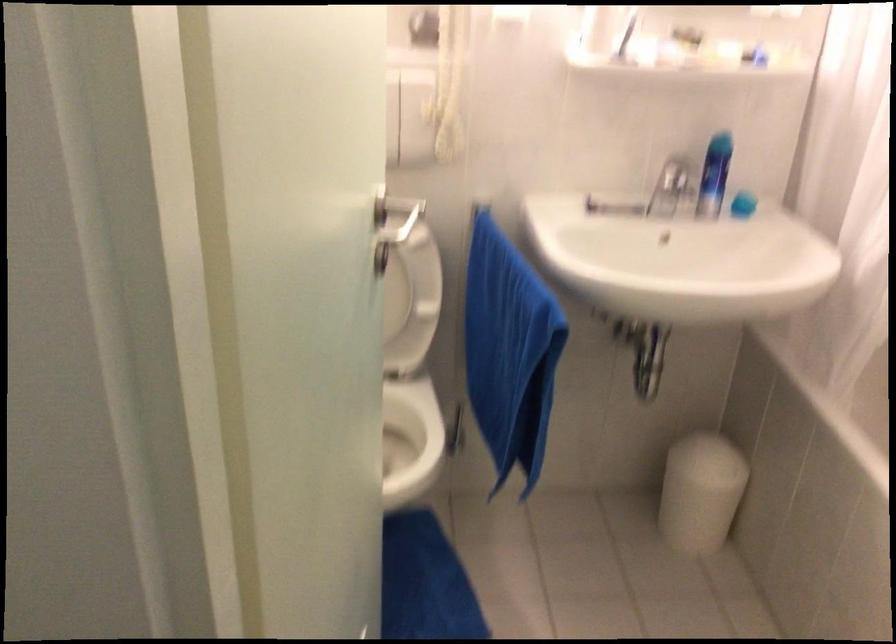
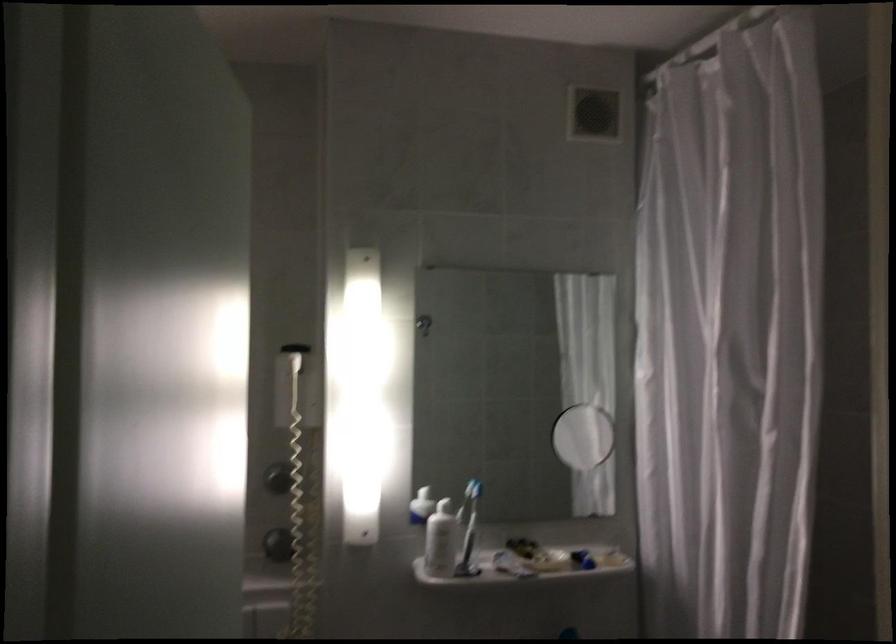
Question: The first image is from the beginning of the video and the second image is from the end. How did the camera likely rotate when shooting the video?

Choices:
 (A) Left
 (B) Right
 (C) Up
 (D) Down

Answer: (C)